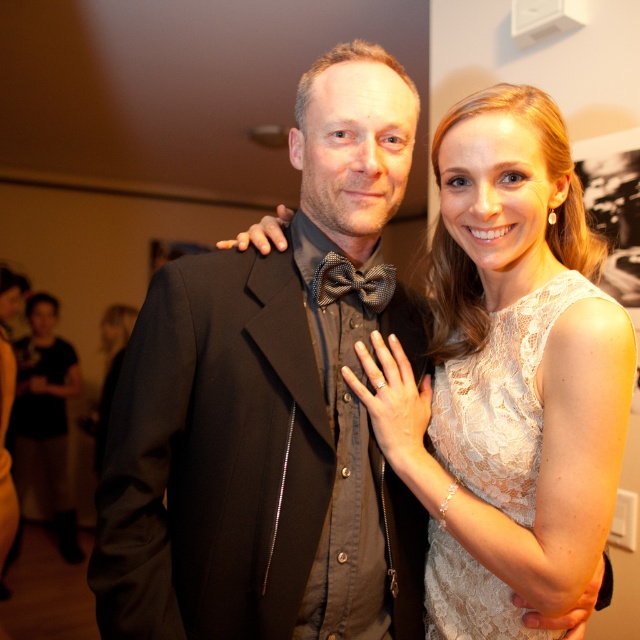
You are a photographer at the event and want to take a closeup of the white lace dress at center and the lace fabric dress at right. Which dress should you focus on to ensure it appears clearer in the photo?

The white lace dress at center is closer to the viewer than the lace fabric dress at right, so focusing on it will make it appear clearer in the photo.

You are a photographer at an art gallery event. You need to take a photo of two guests wearing the white lace dress at center and the lace fabric dress at right. Which guest is standing to the left of the other?

The white lace dress at center is positioned on the left side of lace fabric dress at right, so the guest wearing the white lace dress at center is standing to the left of the guest in the lace fabric dress at right.

You are standing in the art gallery and want to take a photo of the two people in the scene. You have a camera that can only focus on objects within a certain depth range. If you focus on point 1 at point 1 at point (528, 288), will point 2 at point (381, 266) also be in focus?

Point 1 at point (528, 288) is closer to the viewer than point 2 at point (381, 266), so if you focus on point 1, point 2 may not be in focus because it is further away.